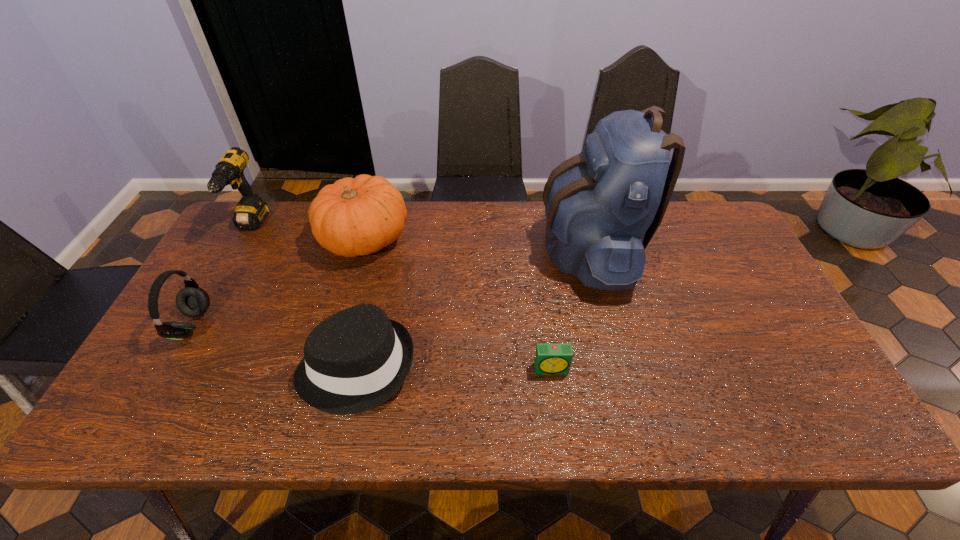
Where is `free space between the headset and the fedora`? This screenshot has width=960, height=540. free space between the headset and the fedora is located at coordinates (275, 346).

Where is `free point between the shortest object and the tallest object`? free point between the shortest object and the tallest object is located at coordinates (570, 308).

Find the location of `empty space between the fifth shortest object and the alarm clock`. empty space between the fifth shortest object and the alarm clock is located at coordinates (401, 298).

Find the location of a particular element. This screenshot has height=540, width=960. unoccupied area between the headset and the second tallest object is located at coordinates (222, 275).

At what (x,y) coordinates should I click in order to perform the action: click on vacant space that's between the backpack and the drill. Please return your answer as a coordinate pair (x, y). The width and height of the screenshot is (960, 540). Looking at the image, I should click on (420, 237).

Identify the location of vacant space that is in between the fedora and the headset. The image size is (960, 540). (275, 346).

The height and width of the screenshot is (540, 960). Find the location of `object that is the closest to the fedora`. object that is the closest to the fedora is located at coordinates (356, 216).

The image size is (960, 540). Find the location of `the fifth closest object to the fedora`. the fifth closest object to the fedora is located at coordinates (250, 212).

This screenshot has height=540, width=960. Find the location of `vacant space that satisfies the following two spatial constraints: 1. on the ear cups of the headset; 2. on the back side of the fedora`. vacant space that satisfies the following two spatial constraints: 1. on the ear cups of the headset; 2. on the back side of the fedora is located at coordinates (168, 367).

Locate an element on the screen. This screenshot has height=540, width=960. free space in the image that satisfies the following two spatial constraints: 1. at the tip of the fedora; 2. on the right side of the second tallest object is located at coordinates (172, 367).